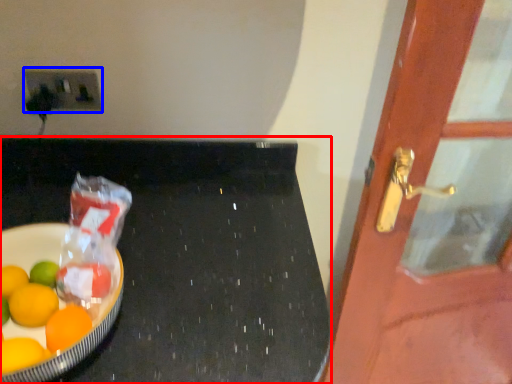
Question: Which object appears closest to the camera in this image, table (highlighted by a red box) or electric outlet (highlighted by a blue box)?

Choices:
 (A) table
 (B) electric outlet

Answer: (A)